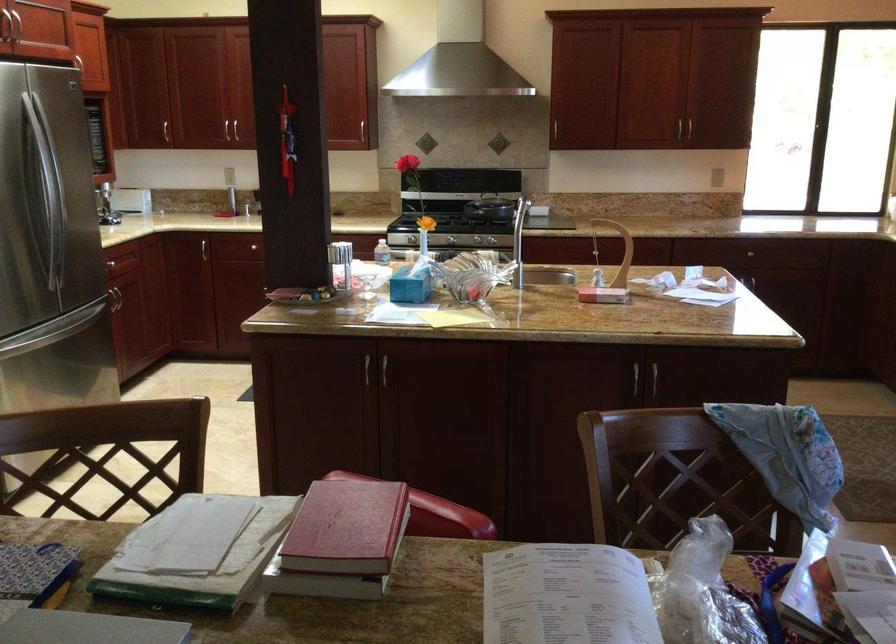
Find the location of `blue tissue box`. blue tissue box is located at coordinates (411, 283).